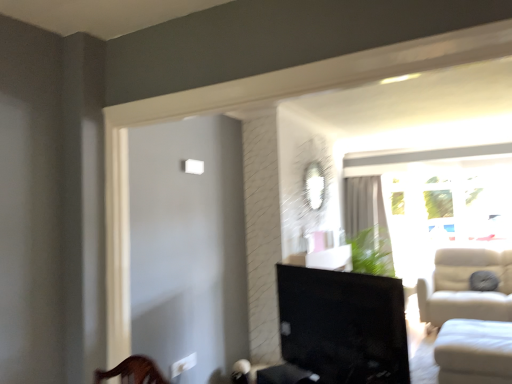
Question: From the image's perspective, is white fabric studio couch at lower right above transparent glass window at right?

Choices:
 (A) no
 (B) yes

Answer: (A)

Question: Is transparent glass window at right inside white fabric studio couch at lower right?

Choices:
 (A) yes
 (B) no

Answer: (B)

Question: From a real-world perspective, is white fabric studio couch at lower right located higher than transparent glass window at right?

Choices:
 (A) yes
 (B) no

Answer: (B)

Question: Does white fabric studio couch at lower right have a greater height compared to transparent glass window at right?

Choices:
 (A) yes
 (B) no

Answer: (B)

Question: Is the position of white fabric studio couch at lower right less distant than that of transparent glass window at right?

Choices:
 (A) yes
 (B) no

Answer: (A)

Question: Is white fabric studio couch at lower right further to the viewer compared to transparent glass window at right?

Choices:
 (A) yes
 (B) no

Answer: (B)

Question: Is white sheer curtain at upper right at the right side of matte black tv at center?

Choices:
 (A) yes
 (B) no

Answer: (A)

Question: From the image's perspective, is white sheer curtain at upper right under matte black tv at center?

Choices:
 (A) yes
 (B) no

Answer: (B)

Question: Is white sheer curtain at upper right outside matte black tv at center?

Choices:
 (A) yes
 (B) no

Answer: (A)

Question: From a real-world perspective, is white sheer curtain at upper right positioned under matte black tv at center based on gravity?

Choices:
 (A) yes
 (B) no

Answer: (B)

Question: Is white sheer curtain at upper right touching matte black tv at center?

Choices:
 (A) yes
 (B) no

Answer: (B)

Question: Is white sheer curtain at upper right far from matte black tv at center?

Choices:
 (A) yes
 (B) no

Answer: (A)

Question: Is transparent glass window at right outside matte black tv at center?

Choices:
 (A) no
 (B) yes

Answer: (B)